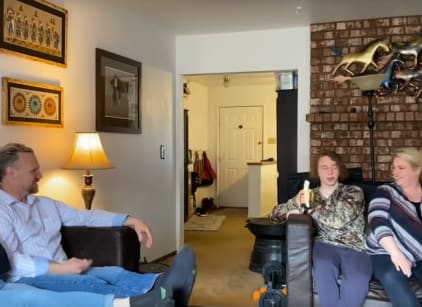
The height and width of the screenshot is (307, 422). In order to click on pictures in this screenshot , I will do `click(34, 110)`, `click(47, 40)`, `click(125, 88)`.